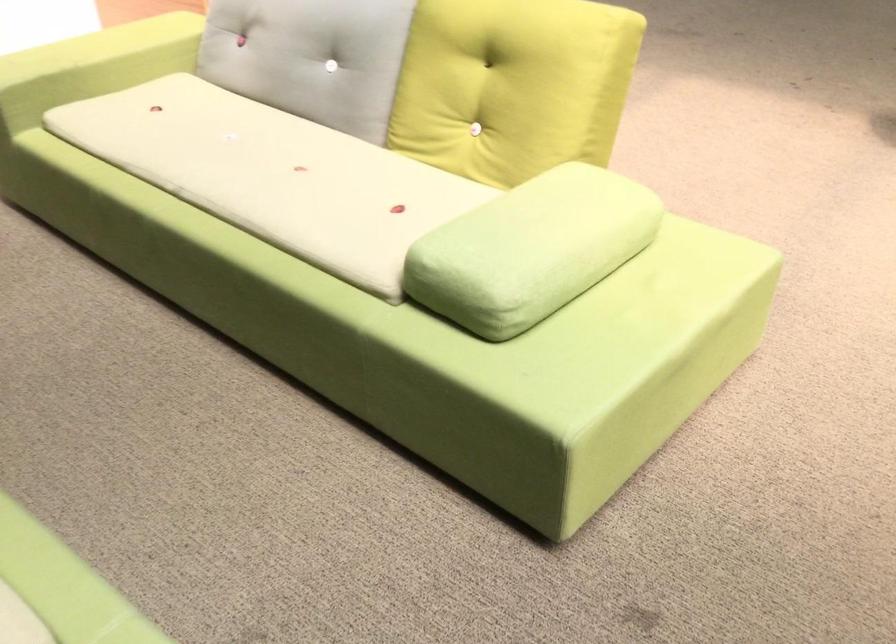
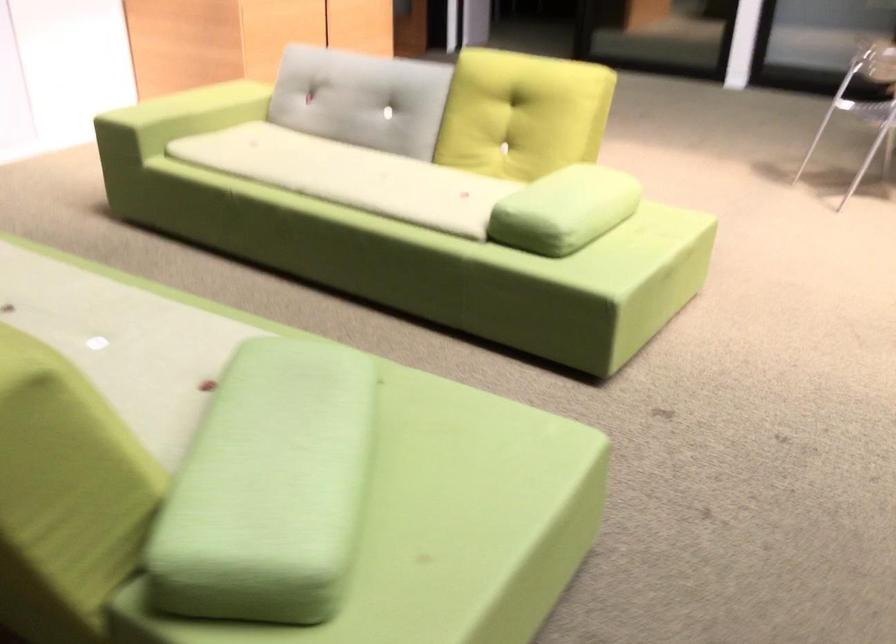
Which direction would the cameraman need to move to produce the second image?

The cameraman walked toward left, backward.